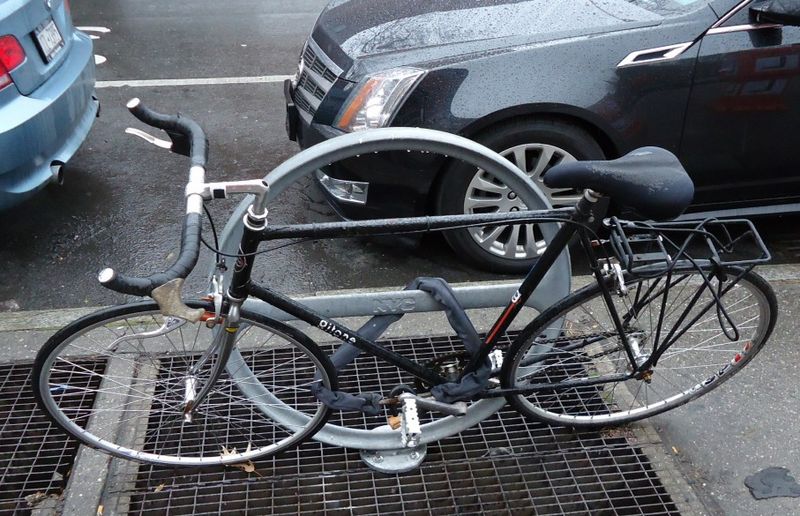
Where is `black seat`? Image resolution: width=800 pixels, height=516 pixels. black seat is located at coordinates click(x=654, y=196).